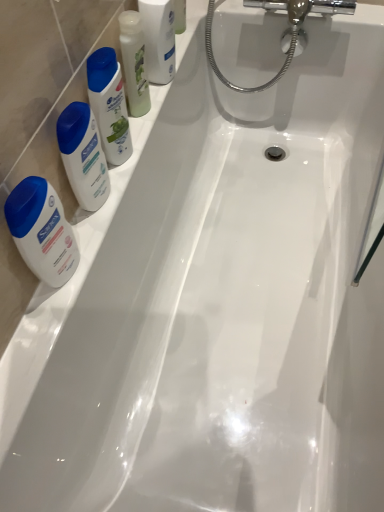
The image size is (384, 512). What do you see at coordinates (109, 104) in the screenshot?
I see `white glossy shampoo bottle at upper left, the second cleaning product ordered from the bottom` at bounding box center [109, 104].

The width and height of the screenshot is (384, 512). Identify the location of matte white lotion at left. (42, 231).

How much space does translucent plastic mouthwash at upper left, marked as the second mouthwash in a right-to-left arrangement, occupy vertically?

translucent plastic mouthwash at upper left, marked as the second mouthwash in a right-to-left arrangement, is 8.27 inches in height.

At what (x,y) coordinates should I click in order to perform the action: click on white glossy shampoo bottle at upper left, the second cleaning product ordered from the bottom. Please return your answer as a coordinate pair (x, y). This screenshot has width=384, height=512. Looking at the image, I should click on (109, 104).

Which object is closer to the camera taking this photo, matte white shampoo at left, the 1th cleaning product when ordered from bottom to top, or matte white lotion at left?

matte white lotion at left is closer to the camera.

Is matte white shampoo at left, arranged as the 2th cleaning product when viewed from the top, positioned with its back to matte white lotion at left?

No, matte white shampoo at left, arranged as the 2th cleaning product when viewed from the top,'s orientation is not away from matte white lotion at left.

Would you say matte white shampoo at left, the 1th cleaning product when ordered from bottom to top, is outside matte white lotion at left?

Yes.

Is clear plastic mouthwash at upper left, which is the 1th mouthwash from right to left, wider or thinner than translucent plastic mouthwash at upper left, which is the 1th mouthwash from left to right?

Considering their sizes, clear plastic mouthwash at upper left, which is the 1th mouthwash from right to left, looks broader than translucent plastic mouthwash at upper left, which is the 1th mouthwash from left to right.

From the image's perspective, relative to translucent plastic mouthwash at upper left, which is the 1th mouthwash from left to right, is clear plastic mouthwash at upper left, which ranks as the 2th mouthwash in left-to-right order, above or below?

clear plastic mouthwash at upper left, which ranks as the 2th mouthwash in left-to-right order, is above translucent plastic mouthwash at upper left, which is the 1th mouthwash from left to right.

I want to click on mouthwash below the clear plastic mouthwash at upper left, which is the 1th mouthwash from right to left (from the image's perspective), so click(134, 62).

Can you confirm if matte white lotion at left is thinner than clear plastic mouthwash at upper left, which ranks as the 2th mouthwash in left-to-right order?

Yes, matte white lotion at left is thinner than clear plastic mouthwash at upper left, which ranks as the 2th mouthwash in left-to-right order.

From the image's perspective, is matte white lotion at left under clear plastic mouthwash at upper left, which is the 1th mouthwash from right to left?

Indeed, from the image's perspective, matte white lotion at left is shown beneath clear plastic mouthwash at upper left, which is the 1th mouthwash from right to left.

You are a GUI agent. You are given a task and a screenshot of the screen. Output one action in this format:
    pyautogui.click(x=<x>, y=<y>)
    Task: Click on the toiletry on the left of clear plastic mouthwash at upper left, which ranks as the 2th mouthwash in left-to-right order
    
    Given the screenshot: What is the action you would take?
    pyautogui.click(x=42, y=231)

In the scene shown: Does matte white lotion at left appear on the right side of clear plastic mouthwash at upper left, which is the 1th mouthwash from right to left?

In fact, matte white lotion at left is to the left of clear plastic mouthwash at upper left, which is the 1th mouthwash from right to left.

Is clear plastic mouthwash at upper left, which ranks as the 2th mouthwash in left-to-right order, surrounded by matte white shampoo at left, the 1th cleaning product when ordered from bottom to top?

No.

Which is farther from the camera, (75,108) or (170,66)?

The point (170,66) is more distant.

From the image's perspective, is matte white shampoo at left, arranged as the 2th cleaning product when viewed from the top, located above or below clear plastic mouthwash at upper left, which is the 1th mouthwash from right to left?

matte white shampoo at left, arranged as the 2th cleaning product when viewed from the top, is situated lower than clear plastic mouthwash at upper left, which is the 1th mouthwash from right to left, in the image.

Locate an element on the screen. The image size is (384, 512). the 2nd cleaning product in front of the clear plastic mouthwash at upper left, which is the 1th mouthwash from right to left is located at coordinates (83, 155).

From the image's perspective, which object appears higher, translucent plastic mouthwash at upper left, which is the 1th mouthwash from left to right, or matte white shampoo at left, the 1th cleaning product when ordered from bottom to top?

translucent plastic mouthwash at upper left, which is the 1th mouthwash from left to right, appears higher in the image.

Looking at this image, are translucent plastic mouthwash at upper left, which is the 1th mouthwash from left to right, and matte white shampoo at left, the 1th cleaning product when ordered from bottom to top, located far from each other?

No.

Can you tell me how much translucent plastic mouthwash at upper left, marked as the second mouthwash in a right-to-left arrangement, and matte white shampoo at left, the 1th cleaning product when ordered from bottom to top, differ in facing direction?

They differ by 0.0106 degrees in their facing directions.

Can you tell me how much matte white lotion at left and translucent plastic mouthwash at upper left, which is the 1th mouthwash from left to right, differ in facing direction?

There is a 0.00798-degree angle between the facing directions of matte white lotion at left and translucent plastic mouthwash at upper left, which is the 1th mouthwash from left to right.

Between matte white lotion at left and translucent plastic mouthwash at upper left, marked as the second mouthwash in a right-to-left arrangement, which one has less height?

Standing shorter between the two is matte white lotion at left.

From the image's perspective, is matte white lotion at left above or below translucent plastic mouthwash at upper left, which is the 1th mouthwash from left to right?

Clearly, from the image's perspective, matte white lotion at left is below translucent plastic mouthwash at upper left, which is the 1th mouthwash from left to right.

From a real-world perspective, is matte white lotion at left over translucent plastic mouthwash at upper left, marked as the second mouthwash in a right-to-left arrangement?

No, from a real-world perspective, matte white lotion at left is not on top of translucent plastic mouthwash at upper left, marked as the second mouthwash in a right-to-left arrangement.

Is white glossy shampoo bottle at upper left, acting as the 1th cleaning product starting from the top, beside clear plastic mouthwash at upper left, which ranks as the 2th mouthwash in left-to-right order?

white glossy shampoo bottle at upper left, acting as the 1th cleaning product starting from the top, and clear plastic mouthwash at upper left, which ranks as the 2th mouthwash in left-to-right order, are not in contact.

Find the location of `cleaning product that is the 1st object directly below the clear plastic mouthwash at upper left, which ranks as the 2th mouthwash in left-to-right order (from a real-world perspective)`. cleaning product that is the 1st object directly below the clear plastic mouthwash at upper left, which ranks as the 2th mouthwash in left-to-right order (from a real-world perspective) is located at coordinates (109, 104).

Based on the photo, is white glossy shampoo bottle at upper left, acting as the 1th cleaning product starting from the top, inside or outside of clear plastic mouthwash at upper left, which ranks as the 2th mouthwash in left-to-right order?

white glossy shampoo bottle at upper left, acting as the 1th cleaning product starting from the top, is not inside clear plastic mouthwash at upper left, which ranks as the 2th mouthwash in left-to-right order, it's outside.

In terms of size, does white glossy shampoo bottle at upper left, acting as the 1th cleaning product starting from the top, appear bigger or smaller than clear plastic mouthwash at upper left, which is the 1th mouthwash from right to left?

In the image, white glossy shampoo bottle at upper left, acting as the 1th cleaning product starting from the top, appears to be smaller than clear plastic mouthwash at upper left, which is the 1th mouthwash from right to left.

Locate an element on the screen. The image size is (384, 512). toiletry below the matte white shampoo at left, arranged as the 2th cleaning product when viewed from the top (from a real-world perspective) is located at coordinates (42, 231).

The width and height of the screenshot is (384, 512). Find the location of `mouthwash in front of the clear plastic mouthwash at upper left, which is the 1th mouthwash from right to left`. mouthwash in front of the clear plastic mouthwash at upper left, which is the 1th mouthwash from right to left is located at coordinates (134, 62).

Which object lies further to the anchor point matte white shampoo at left, arranged as the 2th cleaning product when viewed from the top, clear plastic mouthwash at upper left, which ranks as the 2th mouthwash in left-to-right order, or matte white lotion at left?

clear plastic mouthwash at upper left, which ranks as the 2th mouthwash in left-to-right order, lies further to matte white shampoo at left, arranged as the 2th cleaning product when viewed from the top, than the other object.

Based on their spatial positions, is clear plastic mouthwash at upper left, which ranks as the 2th mouthwash in left-to-right order, or white glossy shampoo bottle at upper left, acting as the 1th cleaning product starting from the top, closer to matte white lotion at left?

The object closer to matte white lotion at left is white glossy shampoo bottle at upper left, acting as the 1th cleaning product starting from the top.

Looking at the image, which one is located closer to clear plastic mouthwash at upper left, which ranks as the 2th mouthwash in left-to-right order, white glossy shampoo bottle at upper left, acting as the 1th cleaning product starting from the top, or matte white shampoo at left, arranged as the 2th cleaning product when viewed from the top?

Based on the image, white glossy shampoo bottle at upper left, acting as the 1th cleaning product starting from the top, appears to be nearer to clear plastic mouthwash at upper left, which ranks as the 2th mouthwash in left-to-right order.

Considering their positions, is clear plastic mouthwash at upper left, which ranks as the 2th mouthwash in left-to-right order, positioned closer to matte white lotion at left than translucent plastic mouthwash at upper left, which is the 1th mouthwash from left to right?

The object closer to matte white lotion at left is translucent plastic mouthwash at upper left, which is the 1th mouthwash from left to right.

Which object lies further to the anchor point white glossy shampoo bottle at upper left, the second cleaning product ordered from the bottom, translucent plastic mouthwash at upper left, which is the 1th mouthwash from left to right, or clear plastic mouthwash at upper left, which ranks as the 2th mouthwash in left-to-right order?

The object further to white glossy shampoo bottle at upper left, the second cleaning product ordered from the bottom, is clear plastic mouthwash at upper left, which ranks as the 2th mouthwash in left-to-right order.

When comparing their distances from translucent plastic mouthwash at upper left, which is the 1th mouthwash from left to right, does clear plastic mouthwash at upper left, which ranks as the 2th mouthwash in left-to-right order, or matte white lotion at left seem closer?

Based on the image, clear plastic mouthwash at upper left, which ranks as the 2th mouthwash in left-to-right order, appears to be nearer to translucent plastic mouthwash at upper left, which is the 1th mouthwash from left to right.

Based on their spatial positions, is translucent plastic mouthwash at upper left, which is the 1th mouthwash from left to right, or matte white lotion at left further from white glossy shampoo bottle at upper left, the second cleaning product ordered from the bottom?

matte white lotion at left is positioned further to the anchor white glossy shampoo bottle at upper left, the second cleaning product ordered from the bottom.

Looking at the image, which one is located further to white glossy shampoo bottle at upper left, acting as the 1th cleaning product starting from the top, matte white lotion at left or translucent plastic mouthwash at upper left, marked as the second mouthwash in a right-to-left arrangement?

Among the two, matte white lotion at left is located further to white glossy shampoo bottle at upper left, acting as the 1th cleaning product starting from the top.

The image size is (384, 512). Find the location of `cleaning product between clear plastic mouthwash at upper left, which is the 1th mouthwash from right to left, and matte white shampoo at left, the 1th cleaning product when ordered from bottom to top, in the vertical direction`. cleaning product between clear plastic mouthwash at upper left, which is the 1th mouthwash from right to left, and matte white shampoo at left, the 1th cleaning product when ordered from bottom to top, in the vertical direction is located at coordinates (109, 104).

At what (x,y) coordinates should I click in order to perform the action: click on mouthwash between clear plastic mouthwash at upper left, which is the 1th mouthwash from right to left, and matte white lotion at left, in the vertical direction. Please return your answer as a coordinate pair (x, y). Image resolution: width=384 pixels, height=512 pixels. Looking at the image, I should click on [x=134, y=62].

The image size is (384, 512). Identify the location of mouthwash between clear plastic mouthwash at upper left, which is the 1th mouthwash from right to left, and matte white shampoo at left, the 1th cleaning product when ordered from bottom to top, in the vertical direction. (134, 62).

The image size is (384, 512). What are the coordinates of `cleaning product between white glossy shampoo bottle at upper left, the second cleaning product ordered from the bottom, and matte white lotion at left from top to bottom` in the screenshot? It's located at (83, 155).